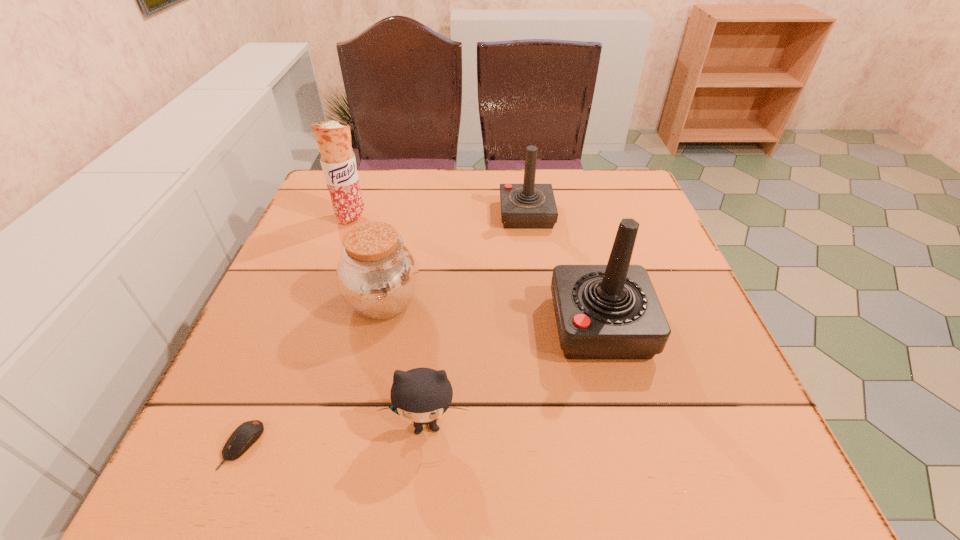
Identify the location of free location located on the rectangular base of the shorter joystick. (540, 315).

Where is `vacant space situated on the front of the jar`? The height and width of the screenshot is (540, 960). vacant space situated on the front of the jar is located at coordinates (372, 352).

Locate an element on the screen. free space located 0.050m on the front-facing side of the kitten is located at coordinates (421, 479).

Image resolution: width=960 pixels, height=540 pixels. Find the location of `free spot located 0.160m on the right of the computer mouse`. free spot located 0.160m on the right of the computer mouse is located at coordinates (363, 446).

Locate an element on the screen. The height and width of the screenshot is (540, 960). burrito positioned at the far edge is located at coordinates (338, 162).

The height and width of the screenshot is (540, 960). I want to click on joystick present at the far edge, so click(x=523, y=206).

Locate an element on the screen. kitten that is at the near edge is located at coordinates (422, 395).

This screenshot has height=540, width=960. Identify the location of computer mouse present at the near edge. (245, 435).

Where is `burrito located at the left edge`? burrito located at the left edge is located at coordinates [338, 162].

Where is `computer mouse located at the left edge`? The image size is (960, 540). computer mouse located at the left edge is located at coordinates [x=245, y=435].